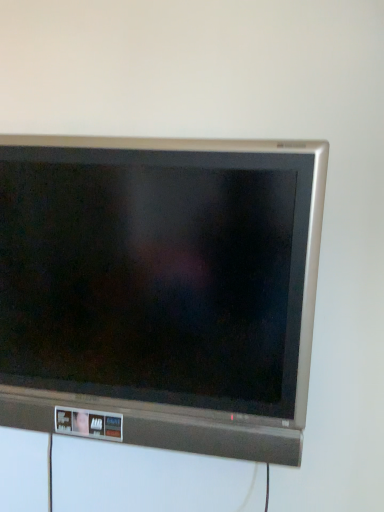
The width and height of the screenshot is (384, 512). Describe the element at coordinates (160, 290) in the screenshot. I see `satin silver television at center` at that location.

What are the coordinates of `satin silver television at center` in the screenshot? It's located at (160, 290).

I want to click on satin silver television at center, so click(160, 290).